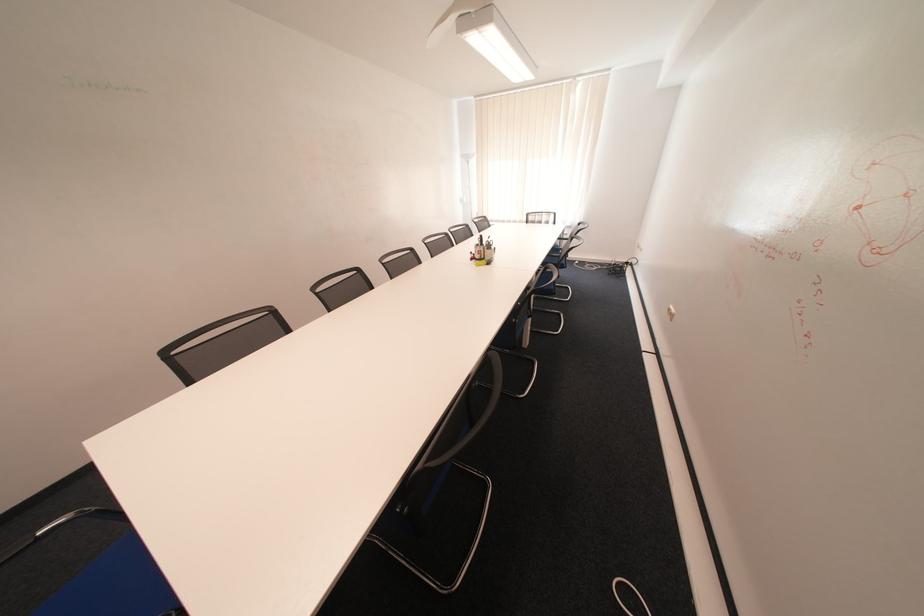
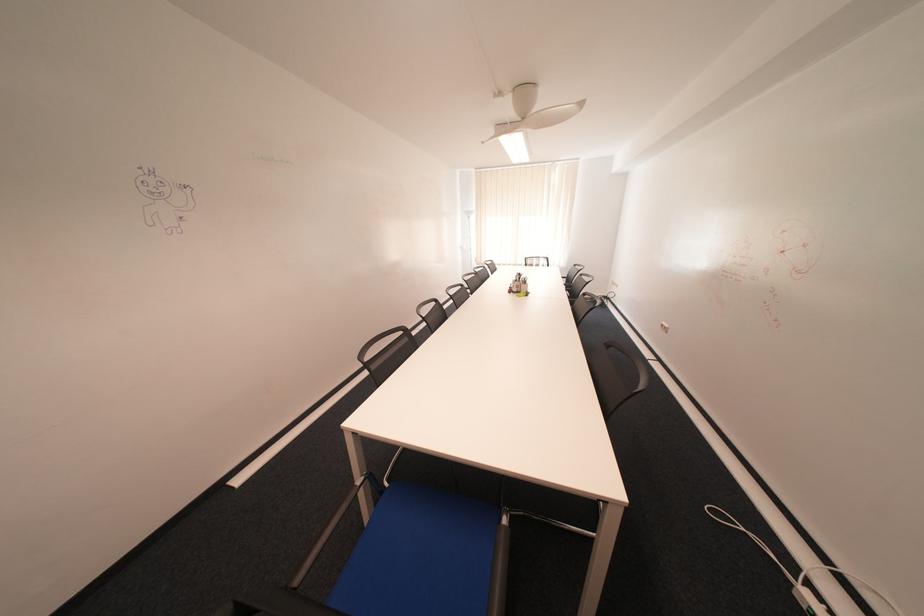
Locate, in the second image, the point that corresponds to [489,256] in the first image.

(526, 290)